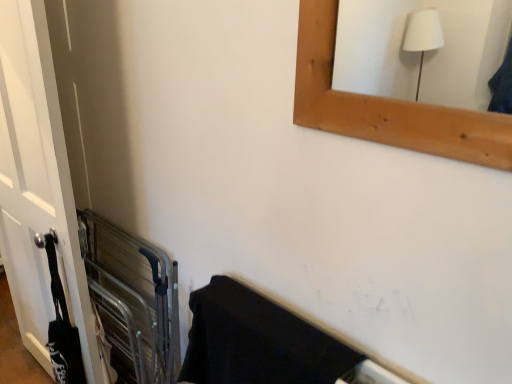
Question: Is black matte towel at lower right at the back of white matte door at left?

Choices:
 (A) yes
 (B) no

Answer: (B)

Question: Considering the relative sizes of white matte door at left and black matte towel at lower right in the image provided, is white matte door at left smaller than black matte towel at lower right?

Choices:
 (A) no
 (B) yes

Answer: (A)

Question: Can you confirm if white matte door at left is bigger than black matte towel at lower right?

Choices:
 (A) yes
 (B) no

Answer: (A)

Question: Considering the relative sizes of white matte door at left and black matte towel at lower right in the image provided, is white matte door at left shorter than black matte towel at lower right?

Choices:
 (A) yes
 (B) no

Answer: (B)

Question: From the image's perspective, is white matte door at left under black matte towel at lower right?

Choices:
 (A) yes
 (B) no

Answer: (B)

Question: In terms of size, does metallic gray balustrade at left appear bigger or smaller than black matte towel at lower right?

Choices:
 (A) small
 (B) big

Answer: (B)

Question: Considering the positions of point (82, 253) and point (239, 284), is point (82, 253) closer or farther from the camera than point (239, 284)?

Choices:
 (A) closer
 (B) farther

Answer: (B)

Question: Would you say metallic gray balustrade at left is to the left or to the right of black matte towel at lower right in the picture?

Choices:
 (A) left
 (B) right

Answer: (A)

Question: Would you say metallic gray balustrade at left is inside or outside black matte towel at lower right?

Choices:
 (A) inside
 (B) outside

Answer: (B)

Question: Considering the positions of white matte door at left and black matte towel at lower right in the image, is white matte door at left taller or shorter than black matte towel at lower right?

Choices:
 (A) short
 (B) tall

Answer: (B)

Question: From a real-world perspective, relative to black matte towel at lower right, is white matte door at left vertically above or below?

Choices:
 (A) above
 (B) below

Answer: (A)

Question: Is white matte door at left situated inside black matte towel at lower right or outside?

Choices:
 (A) outside
 (B) inside

Answer: (A)

Question: Relative to black matte towel at lower right, is white matte door at left in front or behind?

Choices:
 (A) behind
 (B) front

Answer: (A)

Question: From the image's perspective, relative to white matte door at left, is black matte towel at lower right above or below?

Choices:
 (A) below
 (B) above

Answer: (A)

Question: Is black matte towel at lower right in front of or behind white matte door at left in the image?

Choices:
 (A) front
 (B) behind

Answer: (A)